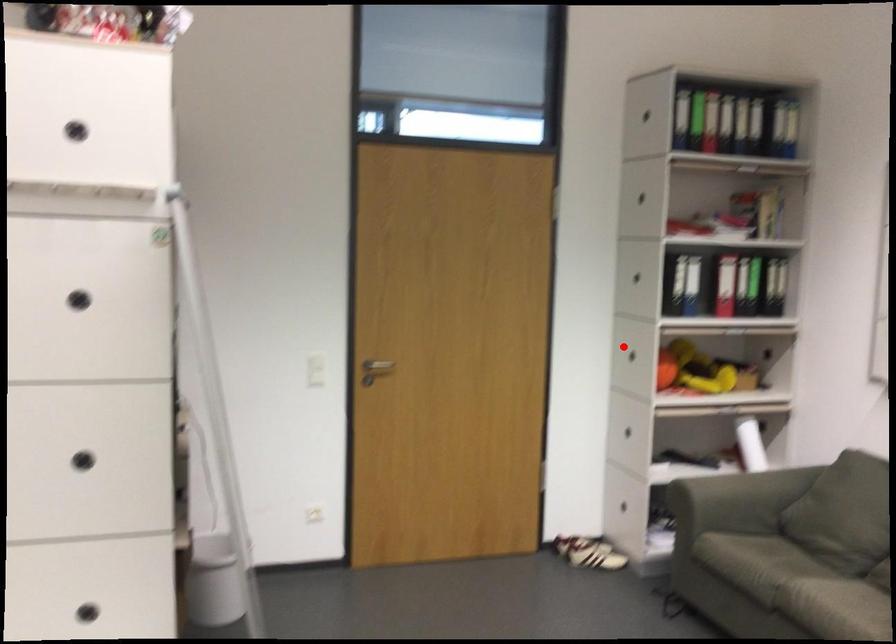
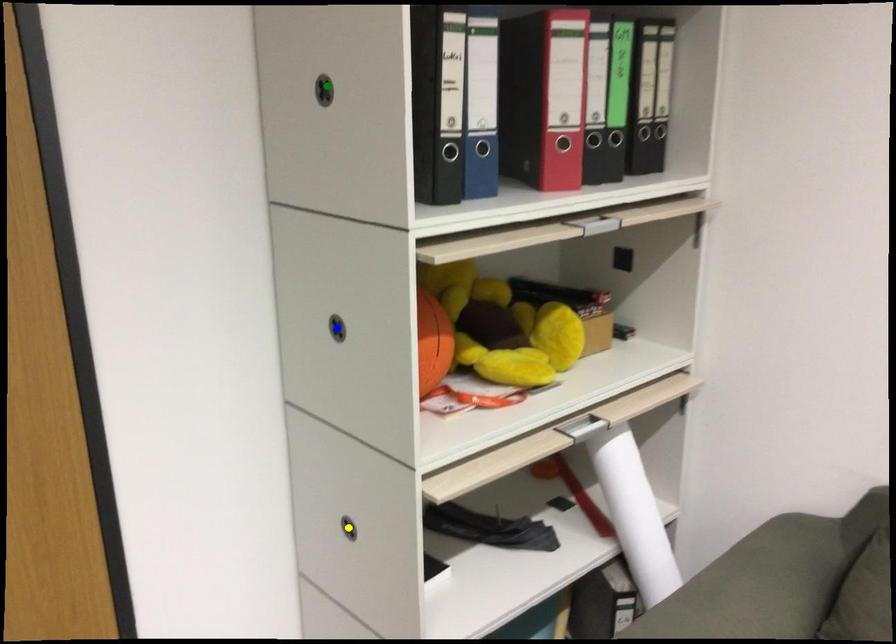
Question: I am providing you with two images of the same scene from different viewpoints. A red point is marked on the first image. You are given multiple points on the second image. In image 2, which mark is for the same physical point as the one in image 1?

Choices:
 (A) green point
 (B) yellow point
 (C) blue point

Answer: (C)